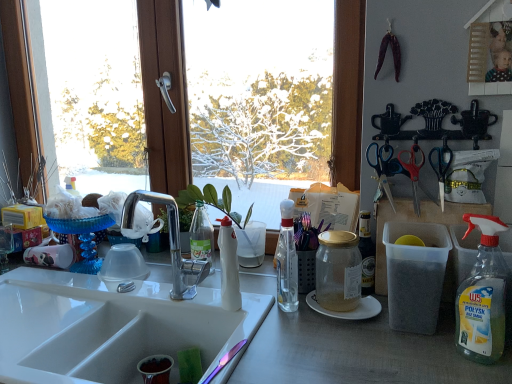
Find the location of `free point above white glossy sink at lower left (from a real-world perspective)`. free point above white glossy sink at lower left (from a real-world perspective) is located at coordinates (234, 320).